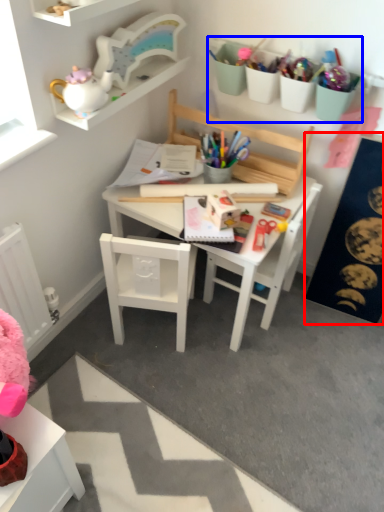
Question: Among these objects, which one is farthest to the camera, bulletin board (highlighted by a red box) or stationery (highlighted by a blue box)?

Choices:
 (A) bulletin board
 (B) stationery

Answer: (B)